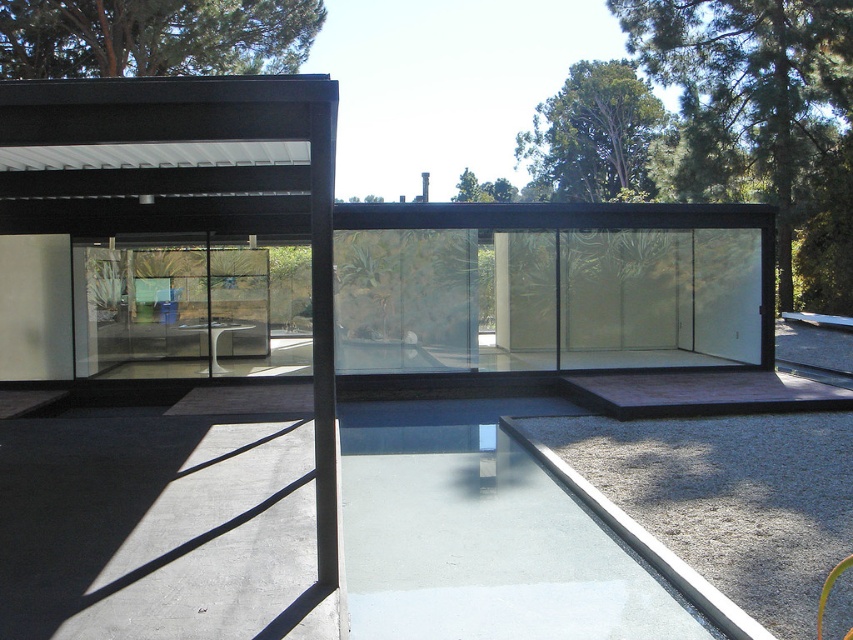
Which is below, transparent glass pool at center or transparent glass door at center?

Positioned lower is transparent glass pool at center.

Is transparent glass pool at center positioned before transparent glass door at center?

Yes, transparent glass pool at center is closer to the viewer.

Identify the location of transparent glass pool at center. The image size is (853, 640). (482, 536).

Who is positioned more to the right, frosted glass wall at center or transparent glass pool at center?

frosted glass wall at center

From the picture: Which of these two, frosted glass wall at center or transparent glass pool at center, stands taller?

frosted glass wall at center is taller.

Who is more distant from viewer, (366, 253) or (643, 572)?

Point (366, 253)

The height and width of the screenshot is (640, 853). Find the location of `frosted glass wall at center`. frosted glass wall at center is located at coordinates (547, 285).

Can you confirm if frosted glass wall at center is positioned to the left of transparent glass door at center?

Incorrect, frosted glass wall at center is not on the left side of transparent glass door at center.

Locate an element on the screen. The image size is (853, 640). frosted glass wall at center is located at coordinates (547, 285).

In order to click on frosted glass wall at center in this screenshot , I will do `click(547, 285)`.